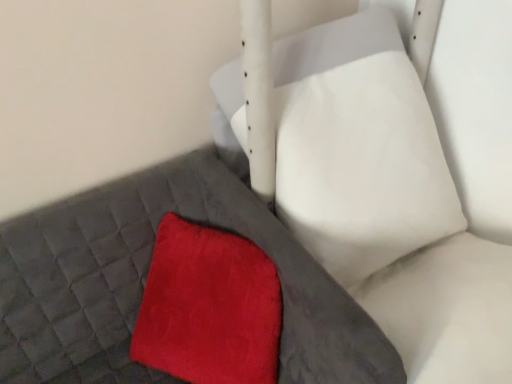
What do you see at coordinates (146, 279) in the screenshot? I see `matte gray bed frame at lower left` at bounding box center [146, 279].

I want to click on matte gray bed frame at lower left, so click(x=146, y=279).

At what (x,y) coordinates should I click in order to perform the action: click on velvet red cushion at center. Please return your answer as a coordinate pair (x, y). The width and height of the screenshot is (512, 384). Looking at the image, I should click on (358, 148).

Is matte gray bed frame at lower left surrounded by velvety red throw pillow at center?

Actually, matte gray bed frame at lower left is outside velvety red throw pillow at center.

Which object is more forward, velvety red throw pillow at center or matte gray bed frame at lower left?

matte gray bed frame at lower left is more forward.

Is velvety red throw pillow at center positioned far away from matte gray bed frame at lower left?

They are positioned close to each other.

Measure the distance from velvety red throw pillow at center to matte gray bed frame at lower left.

velvety red throw pillow at center and matte gray bed frame at lower left are 11.36 centimeters apart from each other.

Which object is more forward, matte gray bed frame at lower left or velvet red cushion at center?

velvet red cushion at center is closer to the camera.

Can you confirm if matte gray bed frame at lower left is positioned to the right of velvet red cushion at center?

Incorrect, matte gray bed frame at lower left is not on the right side of velvet red cushion at center.

Would you say velvet red cushion at center is part of matte gray bed frame at lower left's contents?

No, velvet red cushion at center is not surrounded by matte gray bed frame at lower left.

Is matte gray bed frame at lower left wider or thinner than velvet red cushion at center?

In the image, matte gray bed frame at lower left appears to be more narrow than velvet red cushion at center.

Which of these two, velvet red cushion at center or matte gray bed frame at lower left, stands taller?

Standing taller between the two is velvet red cushion at center.

In the scene shown: Considering the sizes of velvet red cushion at center and matte gray bed frame at lower left in the image, is velvet red cushion at center wider or thinner than matte gray bed frame at lower left?

Clearly, velvet red cushion at center has more width compared to matte gray bed frame at lower left.

Is velvet red cushion at center not inside matte gray bed frame at lower left?

velvet red cushion at center lies outside matte gray bed frame at lower left's area.

Relative to velvety red throw pillow at center, is velvet red cushion at center in front or behind?

Visually, velvet red cushion at center is located in front of velvety red throw pillow at center.

Looking at this image, from a real-world perspective, is velvet red cushion at center above or below velvety red throw pillow at center?

Clearly, from a real-world perspective, velvet red cushion at center is above velvety red throw pillow at center.

How far apart are velvet red cushion at center and velvety red throw pillow at center?

They are 31.54 centimeters apart.

Do you think velvet red cushion at center is within velvety red throw pillow at center, or outside of it?

velvet red cushion at center is located beyond the bounds of velvety red throw pillow at center.

Can you tell me how much matte gray bed frame at lower left and velvety red throw pillow at center differ in facing direction?

0.000119 degrees separate the facing orientations of matte gray bed frame at lower left and velvety red throw pillow at center.

Between matte gray bed frame at lower left and velvety red throw pillow at center, which one has smaller size?

velvety red throw pillow at center is smaller.

From the image's perspective, is matte gray bed frame at lower left positioned above or below velvety red throw pillow at center?

Clearly, from the image's perspective, matte gray bed frame at lower left is below velvety red throw pillow at center.

Between velvety red throw pillow at center and velvet red cushion at center, which one appears on the right side from the viewer's perspective?

Positioned to the right is velvet red cushion at center.

From the image's perspective, which object appears higher, velvety red throw pillow at center or velvet red cushion at center?

velvet red cushion at center, from the image's perspective.

Does velvety red throw pillow at center have a smaller size compared to velvet red cushion at center?

Yes.

In the image, is velvety red throw pillow at center positioned in front of or behind velvet red cushion at center?

Clearly, velvety red throw pillow at center is behind velvet red cushion at center.

In order to click on bed frame below the velvety red throw pillow at center (from the image's perspective) in this screenshot , I will do `click(146, 279)`.

Identify the location of bean bag chair in front of the matte gray bed frame at lower left. The height and width of the screenshot is (384, 512). (358, 148).

Which object lies further to the anchor point matte gray bed frame at lower left, velvety red throw pillow at center or velvet red cushion at center?

velvet red cushion at center is further to matte gray bed frame at lower left.

Considering their positions, is velvety red throw pillow at center positioned further to velvet red cushion at center than matte gray bed frame at lower left?

Among the two, matte gray bed frame at lower left is located further to velvet red cushion at center.

When comparing their distances from velvet red cushion at center, does matte gray bed frame at lower left or velvety red throw pillow at center seem further?

matte gray bed frame at lower left is further to velvet red cushion at center.

Which object lies further to the anchor point velvety red throw pillow at center, matte gray bed frame at lower left or velvet red cushion at center?

velvet red cushion at center is positioned further to the anchor velvety red throw pillow at center.

Considering their positions, is velvet red cushion at center positioned further to matte gray bed frame at lower left than velvety red throw pillow at center?

The object further to matte gray bed frame at lower left is velvet red cushion at center.

Looking at the image, which one is located further to velvety red throw pillow at center, velvet red cushion at center or matte gray bed frame at lower left?

Among the two, velvet red cushion at center is located further to velvety red throw pillow at center.

The height and width of the screenshot is (384, 512). In order to click on throw pillow between matte gray bed frame at lower left and velvet red cushion at center in the horizontal direction in this screenshot , I will do `click(209, 307)`.